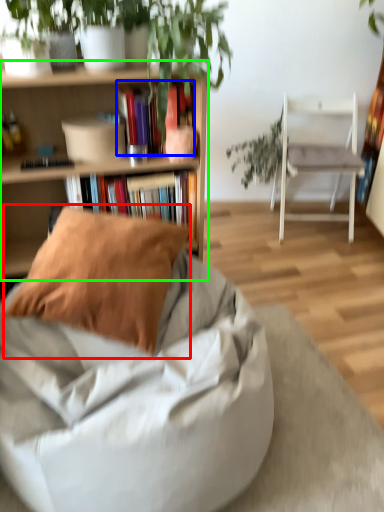
Question: Considering the real-world distances, which object is closest to pillow (highlighted by a red box)? book (highlighted by a blue box) or shelf (highlighted by a green box).

Choices:
 (A) book
 (B) shelf

Answer: (B)